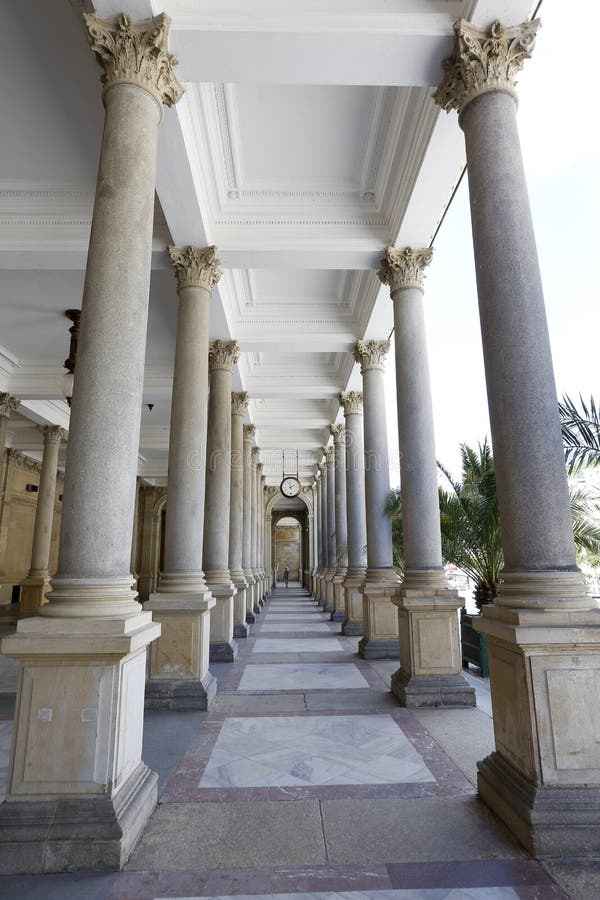
I want to click on white roof, so click(x=284, y=244).